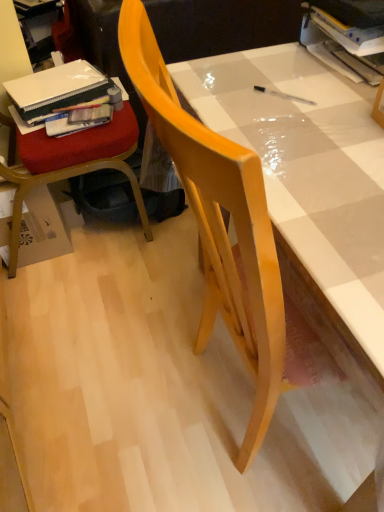
This screenshot has height=512, width=384. Find the location of `matte plastic book at upper right, the 1th book when ordered from right to left`. matte plastic book at upper right, the 1th book when ordered from right to left is located at coordinates (352, 46).

Identify the location of white matte book at upper left, the third book when ordered from front to back. (57, 92).

What is the approximate width of white matte book at upper left, the third book when ordered from front to back?

white matte book at upper left, the third book when ordered from front to back, is 8.84 inches wide.

Where is `brown cardboard box at lower left`? brown cardboard box at lower left is located at coordinates (41, 229).

The height and width of the screenshot is (512, 384). Identify the location of matte plastic book at left, the 2th book from the left. (78, 120).

Where is `wooden chair at left, which appears as the 2th chair when viewed from the right`? This screenshot has height=512, width=384. wooden chair at left, which appears as the 2th chair when viewed from the right is located at coordinates (62, 180).

From a real-world perspective, is matte wood chair at center, positioned as the second chair in left-to-right order, positioned above or below white matte book at upper left, the 1th book from the back?

matte wood chair at center, positioned as the second chair in left-to-right order, is above white matte book at upper left, the 1th book from the back.

Which is correct: matte wood chair at center, positioned as the second chair in left-to-right order, is inside white matte book at upper left, which is counted as the first book, starting from the left, or outside of it?

matte wood chair at center, positioned as the second chair in left-to-right order, is not inside white matte book at upper left, which is counted as the first book, starting from the left, it's outside.

Is matte wood chair at center, the first chair viewed from the right, to the right of white matte book at upper left, which is the 3th book in right-to-left order, from the viewer's perspective?

Correct, you'll find matte wood chair at center, the first chair viewed from the right, to the right of white matte book at upper left, which is the 3th book in right-to-left order.

Is matte white table at center at the back of wooden chair at left, which appears as the 2th chair when viewed from the right?

No, wooden chair at left, which appears as the 2th chair when viewed from the right,'s orientation is not away from matte white table at center.

Considering the sizes of objects wooden chair at left, which appears as the 2th chair when viewed from the right, and matte white table at center in the image provided, who is smaller, wooden chair at left, which appears as the 2th chair when viewed from the right, or matte white table at center?

wooden chair at left, which appears as the 2th chair when viewed from the right, is smaller.

From their relative heights in the image, would you say wooden chair at left, which appears as the 2th chair when viewed from the right, is taller or shorter than matte white table at center?

In the image, wooden chair at left, which appears as the 2th chair when viewed from the right, appears to be taller than matte white table at center.

Considering the sizes of brown cardboard box at lower left and matte wood chair at center, positioned as the second chair in left-to-right order, in the image, is brown cardboard box at lower left bigger or smaller than matte wood chair at center, positioned as the second chair in left-to-right order,?

Considering their sizes, brown cardboard box at lower left takes up less space than matte wood chair at center, positioned as the second chair in left-to-right order.

From a real-world perspective, which object stands above the other?

In real-world perspective, matte wood chair at center, positioned as the second chair in left-to-right order, is above.

Which is more to the right, brown cardboard box at lower left or matte wood chair at center, positioned as the second chair in left-to-right order?

Positioned to the right is matte wood chair at center, positioned as the second chair in left-to-right order.

Does white matte book at upper left, which is counted as the first book, starting from the left, have a greater height compared to matte plastic book at upper right, the 1th book when ordered from right to left?

→ No.

Is matte plastic book at upper right, the 3th book in the back-to-front sequence, completely or partially inside white matte book at upper left, the third book when ordered from front to back?

That's incorrect, matte plastic book at upper right, the 3th book in the back-to-front sequence, is not inside white matte book at upper left, the third book when ordered from front to back.

Based on the photo, is the position of white matte book at upper left, the third book when ordered from front to back, more distant than that of matte plastic book at upper right, arranged as the 1th book when viewed from the front?

Yes.

From a real-world perspective, is white matte book at upper left, which is counted as the first book, starting from the left, under matte plastic book at upper right, the 3th book in the back-to-front sequence?

Yes, from a real-world perspective, white matte book at upper left, which is counted as the first book, starting from the left, is below matte plastic book at upper right, the 3th book in the back-to-front sequence.

From a real-world perspective, is matte wood chair at center, the first chair viewed from the right, positioned under wooden chair at left, the first chair viewed from the left, based on gravity?

Actually, matte wood chair at center, the first chair viewed from the right, is physically above wooden chair at left, the first chair viewed from the left, in the real world.

From the image's perspective, is matte wood chair at center, the first chair viewed from the right, located above wooden chair at left, the first chair viewed from the left?

Actually, matte wood chair at center, the first chair viewed from the right, appears below wooden chair at left, the first chair viewed from the left, in the image.

Does point (224, 174) appear closer or farther from the camera than point (18, 71)?

Point (224, 174).

Is matte plastic book at upper right, the 3th book in the back-to-front sequence, to the right of wooden chair at left, the first chair viewed from the left, from the viewer's perspective?

Indeed, matte plastic book at upper right, the 3th book in the back-to-front sequence, is positioned on the right side of wooden chair at left, the first chair viewed from the left.

Would you say wooden chair at left, the first chair viewed from the left, is part of matte plastic book at upper right, which is the third book in left-to-right order,'s contents?

Actually, wooden chair at left, the first chair viewed from the left, is outside matte plastic book at upper right, which is the third book in left-to-right order.

Considering the points (364, 69) and (9, 170), which point is in front, point (364, 69) or point (9, 170)?

Point (364, 69)

Is matte plastic book at upper right, the 3th book in the back-to-front sequence, positioned in front of wooden chair at left, the first chair viewed from the left?

Yes, it is.

Which is closer to the camera, (337, 22) or (80, 120)?

Point (337, 22) is closer to the camera than point (80, 120).

Considering the relative positions of matte plastic book at upper right, which is the third book in left-to-right order, and matte plastic book at left, positioned as the second book in back-to-front order, in the image provided, is matte plastic book at upper right, which is the third book in left-to-right order, to the left of matte plastic book at left, positioned as the second book in back-to-front order, from the viewer's perspective?

No.

Is matte plastic book at upper right, the 3th book in the back-to-front sequence, oriented towards matte plastic book at left, the 2th book positioned from the front?

No, matte plastic book at upper right, the 3th book in the back-to-front sequence, is not oriented towards matte plastic book at left, the 2th book positioned from the front.

Based on the photo, from the image's perspective, is matte plastic book at upper right, arranged as the 1th book when viewed from the front, positioned above or below matte plastic book at left, the 2th book positioned from the front?

matte plastic book at upper right, arranged as the 1th book when viewed from the front, is situated higher than matte plastic book at left, the 2th book positioned from the front, in the image.

Find the location of a particular element. This screenshot has width=384, height=512. the 2nd chair in front of the white matte book at upper left, the 1th book from the back, starting your count from the anchor is located at coordinates (219, 226).

Where is `table lying below the wooden chair at left, which appears as the 2th chair when viewed from the right (from the image's perspective)`? table lying below the wooden chair at left, which appears as the 2th chair when viewed from the right (from the image's perspective) is located at coordinates (309, 170).

Looking at the image, which one is located further to matte plastic book at left, which ranks as the 2th book in right-to-left order, matte white table at center or white matte book at upper left, which is counted as the first book, starting from the left?

matte white table at center.

Based on their spatial positions, is matte plastic book at upper right, the 1th book when ordered from right to left, or white matte book at upper left, which is counted as the first book, starting from the left, closer to matte wood chair at center, positioned as the second chair in left-to-right order?

matte plastic book at upper right, the 1th book when ordered from right to left, is closer to matte wood chair at center, positioned as the second chair in left-to-right order.

Based on their spatial positions, is wooden chair at left, which appears as the 2th chair when viewed from the right, or matte plastic book at upper right, arranged as the 1th book when viewed from the front, further from matte wood chair at center, positioned as the second chair in left-to-right order?

The object further to matte wood chair at center, positioned as the second chair in left-to-right order, is wooden chair at left, which appears as the 2th chair when viewed from the right.

From the image, which object appears to be farther from matte plastic book at upper right, arranged as the 1th book when viewed from the front, wooden chair at left, which appears as the 2th chair when viewed from the right, or matte plastic book at left, the 2th book positioned from the front?

matte plastic book at left, the 2th book positioned from the front, lies further to matte plastic book at upper right, arranged as the 1th book when viewed from the front, than the other object.

Based on their spatial positions, is white matte book at upper left, which is counted as the first book, starting from the left, or matte plastic book at left, which ranks as the 2th book in right-to-left order, closer to matte white table at center?

matte plastic book at left, which ranks as the 2th book in right-to-left order, is closer to matte white table at center.

From the image, which object appears to be nearer to matte white table at center, brown cardboard box at lower left or wooden chair at left, the first chair viewed from the left?

Among the two, wooden chair at left, the first chair viewed from the left, is located nearer to matte white table at center.

Considering their positions, is matte white table at center positioned further to matte wood chair at center, positioned as the second chair in left-to-right order, than matte plastic book at upper right, arranged as the 1th book when viewed from the front?

Based on the image, matte plastic book at upper right, arranged as the 1th book when viewed from the front, appears to be further to matte wood chair at center, positioned as the second chair in left-to-right order.

Which object lies nearer to the anchor point matte white table at center, white matte book at upper left, the third book when ordered from front to back, or wooden chair at left, which appears as the 2th chair when viewed from the right?

Among the two, wooden chair at left, which appears as the 2th chair when viewed from the right, is located nearer to matte white table at center.

Where is `chair between wooden chair at left, the first chair viewed from the left, and matte plastic book at upper right, arranged as the 1th book when viewed from the front`? The width and height of the screenshot is (384, 512). chair between wooden chair at left, the first chair viewed from the left, and matte plastic book at upper right, arranged as the 1th book when viewed from the front is located at coordinates (219, 226).

Identify the location of chair between matte wood chair at center, the first chair viewed from the right, and white matte book at upper left, which is the 3th book in right-to-left order, along the z-axis. point(62,180).

Image resolution: width=384 pixels, height=512 pixels. I want to click on book located between matte wood chair at center, the first chair viewed from the right, and matte plastic book at left, the 2th book positioned from the front, in the depth direction, so click(352, 46).

Find the location of a particular element. book between matte plastic book at left, the 2th book positioned from the front, and matte white table at center, in the horizontal direction is located at coordinates (352, 46).